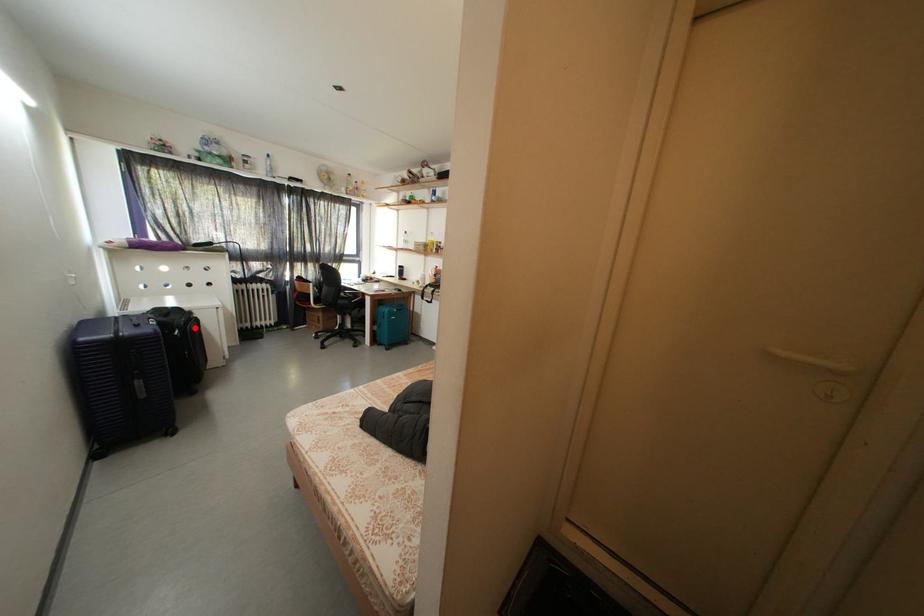
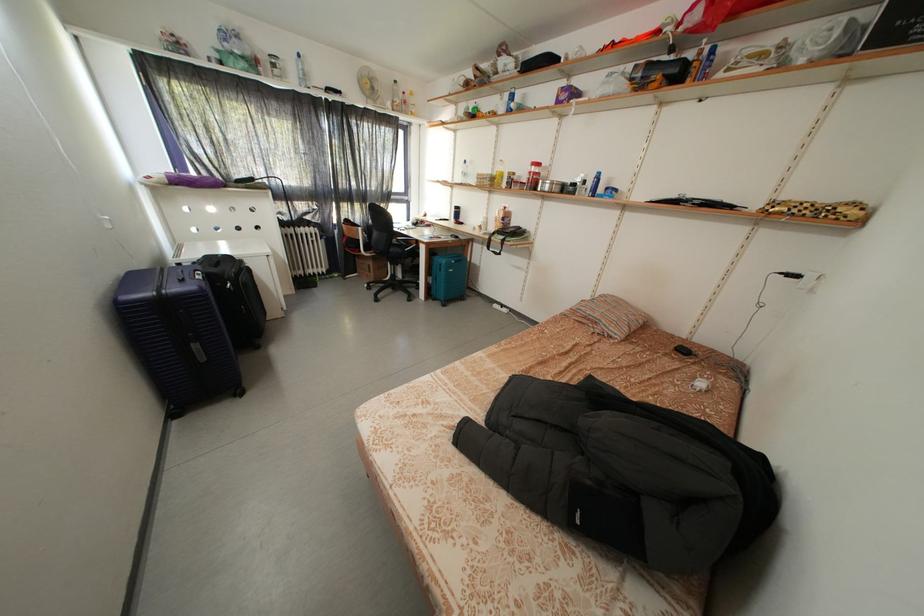
Question: I am providing you with two images of the same scene from different viewpoints. Image1 has a red point marked. In image2, the corresponding 3D location appears at what relative position? Reply with the corresponding letter.

Choices:
 (A) Closer
 (B) Farther

Answer: (A)